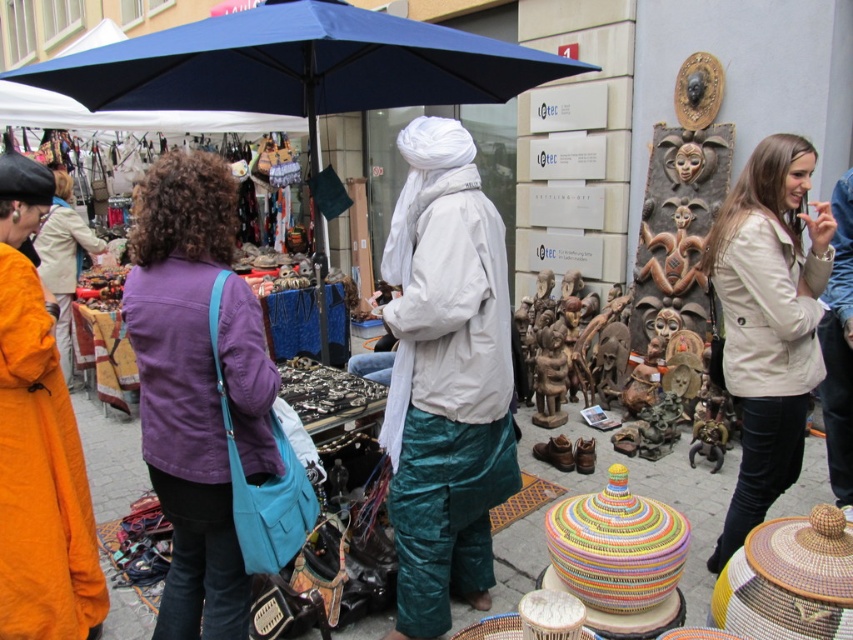
Question: Is beige leather jacket at upper right in front of purple fabric bag at upper left?

Choices:
 (A) yes
 (B) no

Answer: (A)

Question: Does blue fabric umbrella at center lie behind purple fabric bag at upper left?

Choices:
 (A) no
 (B) yes

Answer: (A)

Question: Which object is farther from the camera taking this photo?

Choices:
 (A) purple cotton jacket at center
 (B) white satin turban at center

Answer: (B)

Question: Can you confirm if purple cotton jacket at center is positioned below purple fabric bag at upper left?

Choices:
 (A) yes
 (B) no

Answer: (A)

Question: Which of these objects is positioned closest to the white satin turban at center?

Choices:
 (A) blue fabric umbrella at center
 (B) purple fabric bag at upper left
 (C) purple cotton jacket at center

Answer: (C)

Question: Which object appears farthest from the camera in this image?

Choices:
 (A) blue fabric umbrella at center
 (B) purple cotton jacket at center

Answer: (A)